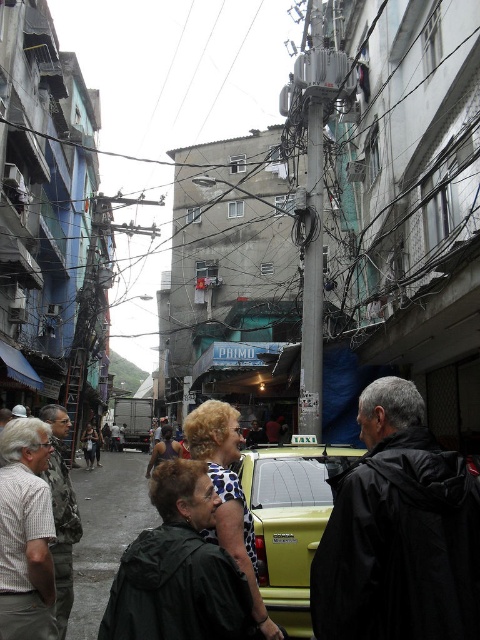
Question: Does green matte taxi at center come in front of green matte jacket at lower left?

Choices:
 (A) no
 (B) yes

Answer: (A)

Question: Which object appears closest to the camera in this image?

Choices:
 (A) polka dot blouse at center
 (B) dark green jacket at center
 (C) green matte taxi at center
 (D) green matte jacket at lower left

Answer: (B)

Question: Can you confirm if dark green jacket at center is positioned above leather jacket at center?

Choices:
 (A) yes
 (B) no

Answer: (A)

Question: Which object appears farthest from the camera in this image?

Choices:
 (A) polka dot blouse at center
 (B) leather jacket at center

Answer: (B)

Question: Is dark green jacket at center bigger than green matte taxi at center?

Choices:
 (A) no
 (B) yes

Answer: (B)

Question: Which of the following is the closest to the observer?

Choices:
 (A) leather jacket at center
 (B) dark blue fabric bag at center
 (C) polka dot blouse at center

Answer: (C)